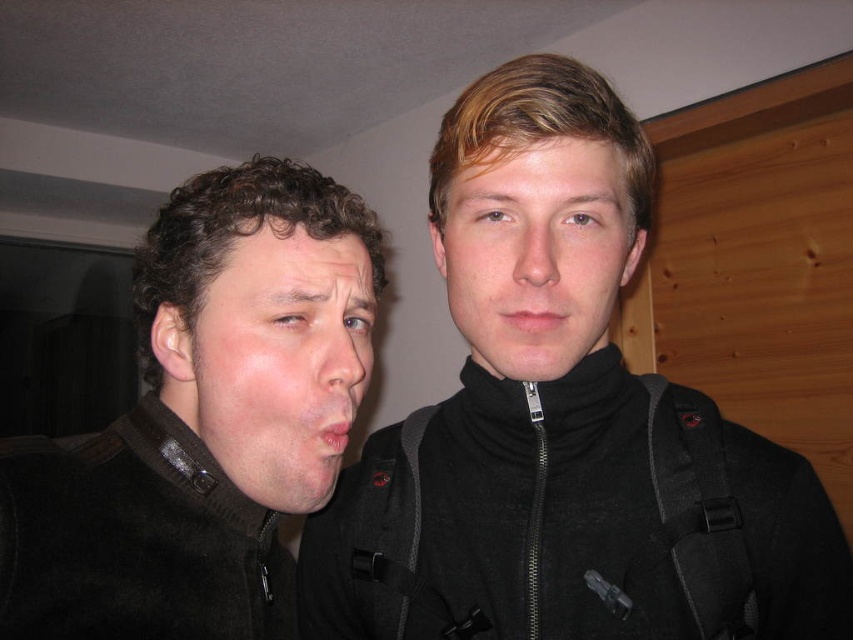
You are an artist trying to sketch this scene. You need to decide which object to draw first based on their sizes. Since the matte black face at left is taller than the matte black mouth at center, which one should you start with?

The matte black face at left is taller than the matte black mouth at center, so you should start with the matte black face at left as it requires more space and detail.

You are designing a poster and need to place text on the image. The text should be positioned between the matte black face at left and the matte black mouth at center. Which object should the text be closer to?

The text should be closer to the matte black mouth at center because the matte black face at left might be wider than the matte black mouth at center, so placing the text closer to the mouth would ensure it stays within the narrower area between them.